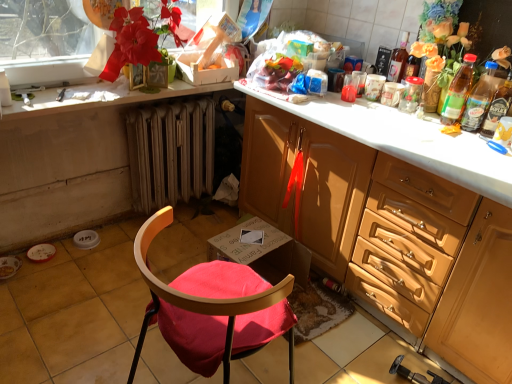
Find the location of a particular element. This screenshot has width=512, height=384. blank space above white glossy countertop at upper left (from a real-world perspective) is located at coordinates (126, 89).